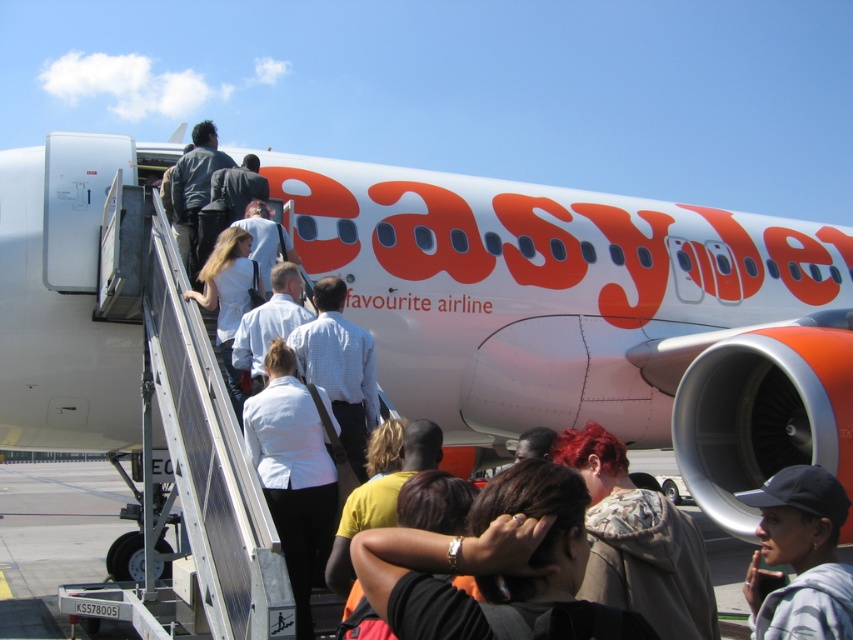
You are standing at the boarding gate and want to take a photo of the airplane. There are two points on the airplane that you want to focus on. The first point is at coordinate point(540,561) and the second is at point(833,557). Which point will appear larger in your photo?

Point(540,561) is closer to the camera than point(833,557), so it will appear larger in the photo.

You are an airport security officer checking the boarding area. You notice two items in the scene described above. One is a dark brown hair at center and the other is a gray fabric cap at lower right. Which of these two items is smaller in size?

The dark brown hair at center is smaller in size compared to the gray fabric cap at lower right.